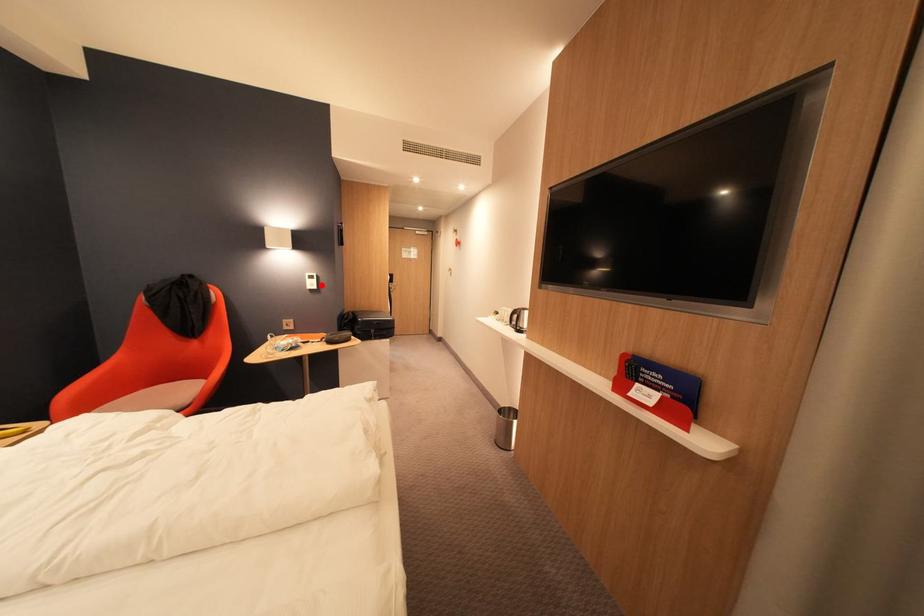
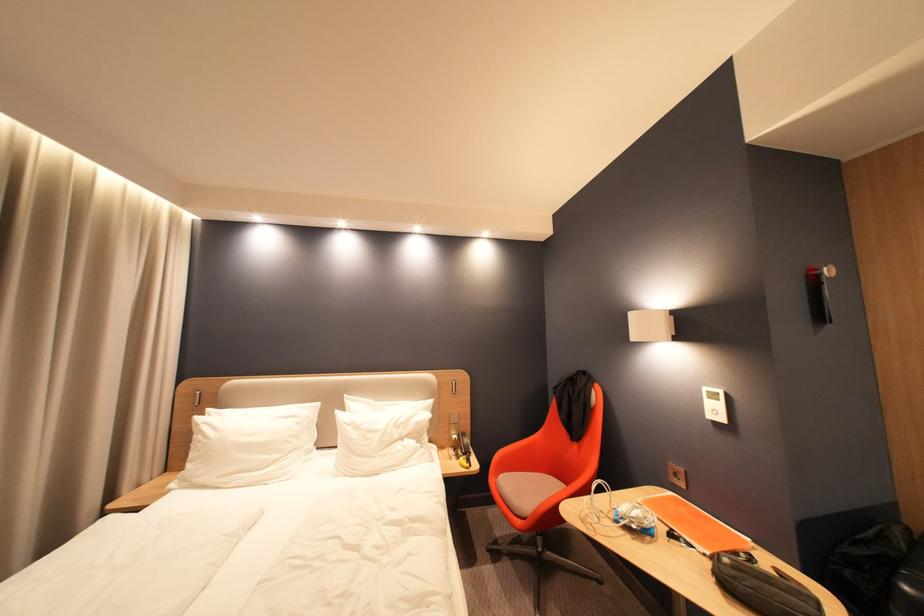
Find the pixel in the second image that matches the highlighted location in the first image.

(724, 413)